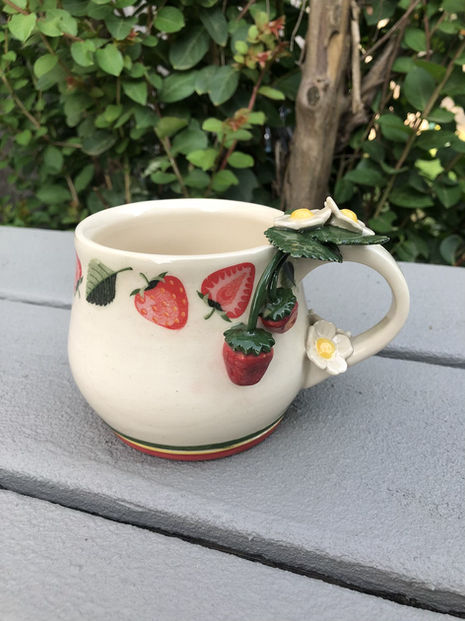
The image size is (465, 621). Find the location of `mug`. mug is located at coordinates (260, 406).